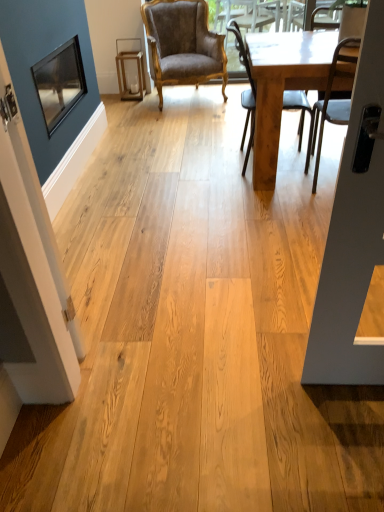
Where is `vacant space that's between metallic silver chair at right, which is the 3th chair from back to front, and light brown wooden table at right`? This screenshot has height=512, width=384. vacant space that's between metallic silver chair at right, which is the 3th chair from back to front, and light brown wooden table at right is located at coordinates (291, 196).